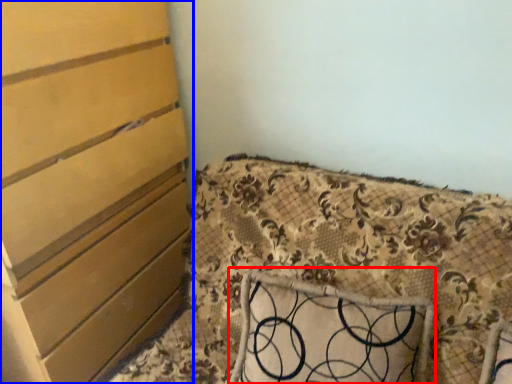
Question: Which point is further to the camera, pillow (highlighted by a red box) or chest of drawers (highlighted by a blue box)?

Choices:
 (A) pillow
 (B) chest of drawers

Answer: (A)